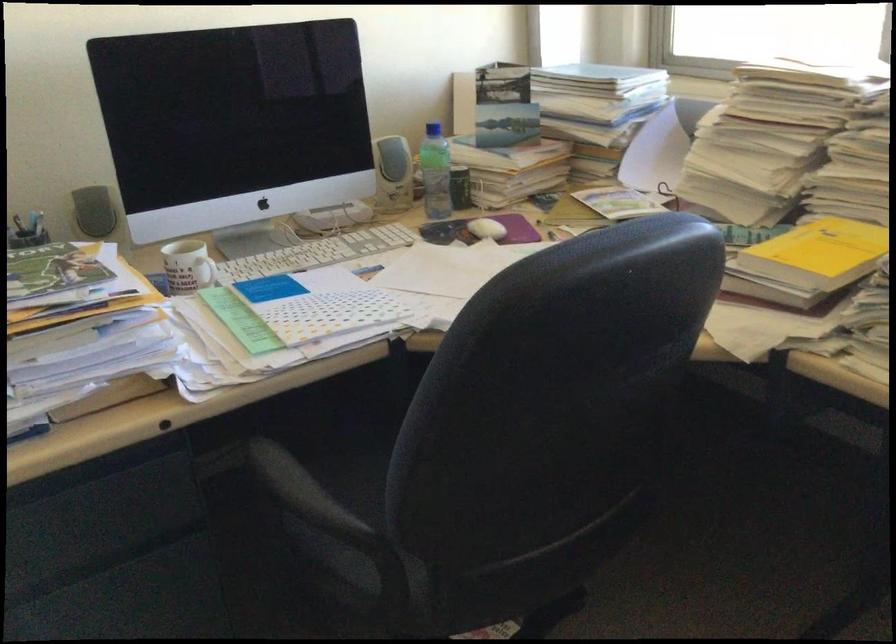
Locate an element on the screen. The image size is (896, 644). blue bottle cap is located at coordinates (433, 129).